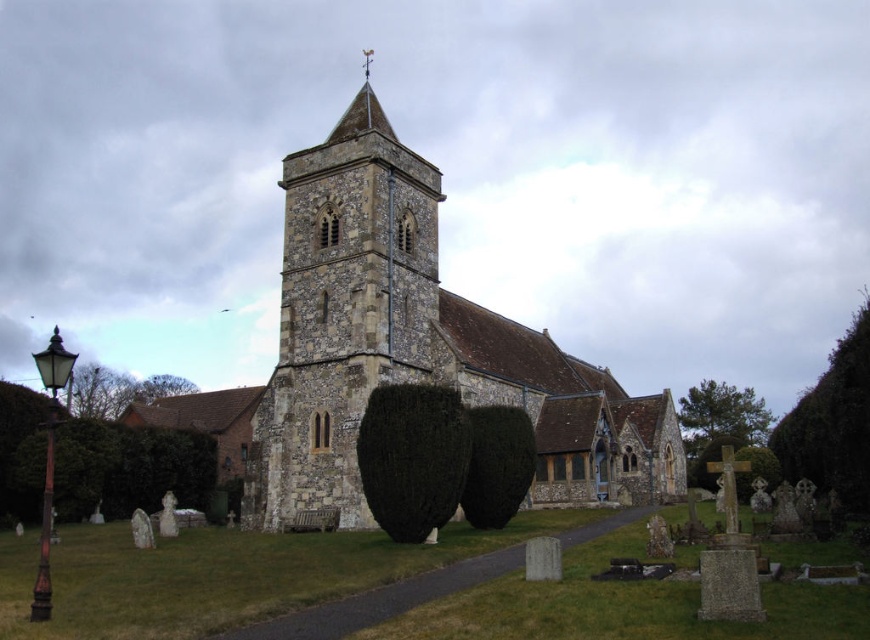
You are standing at the entrance of the church and want to walk towards the bell tower. There are two points marked on the ground in front of you. One is at point (336, 252) and the other is at point (399, 285). Which point should you step on first if you want to follow the path leading directly to the bell tower?

You should step on point (336, 252) first because it is in front of point (399, 285) along the path leading to the bell tower.

You are standing in front of the church and want to take a photo that includes both the stone tower at center and the paved pathway leading to it. Given that your camera has a maximum zoom range of 50 meters, will you be able to capture both elements in a single frame without moving closer?

The stone tower at center is 53.73 meters away from the viewer. Since the camera can only zoom up to 50 meters, you won cannot capture both elements in a single frame without moving closer.